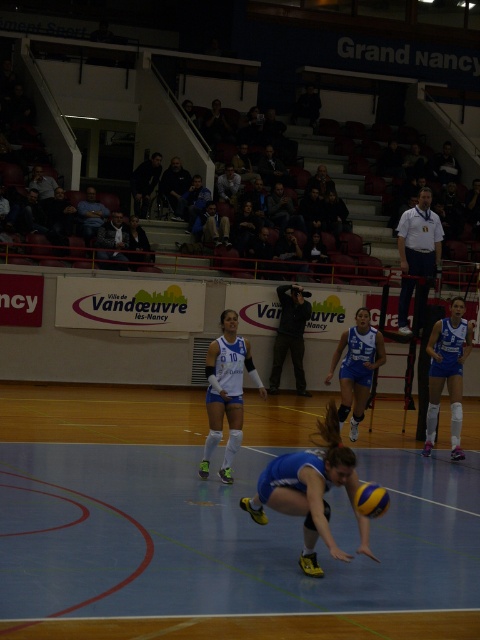
Which is behind, point (359, 308) or point (372, 493)?

Point (359, 308)

Between blue matte volleyball player at center and yellow matte/vinyl volleyball at center, which one is positioned higher?

blue matte volleyball player at center is higher up.

What are the coordinates of `blue matte volleyball player at center` in the screenshot? It's located at (357, 368).

Where is `blue matte volleyball player at center`? blue matte volleyball player at center is located at coordinates (357, 368).

Locate an element on the screen. white matte uniform at center is located at coordinates (227, 392).

Is white matte uniform at center thinner than blue matte volleyball player at center?

Indeed, white matte uniform at center has a lesser width compared to blue matte volleyball player at center.

Locate an element on the screen. The width and height of the screenshot is (480, 640). white matte uniform at center is located at coordinates (227, 392).

What do you see at coordinates (227, 392) in the screenshot? I see `white matte uniform at center` at bounding box center [227, 392].

Is point (228, 378) positioned before point (358, 493)?

No, it is behind (358, 493).

Between point (235, 422) and point (381, 508), which one is positioned behind?

Positioned behind is point (235, 422).

Locate an element on the screen. The image size is (480, 640). white matte uniform at center is located at coordinates tap(227, 392).